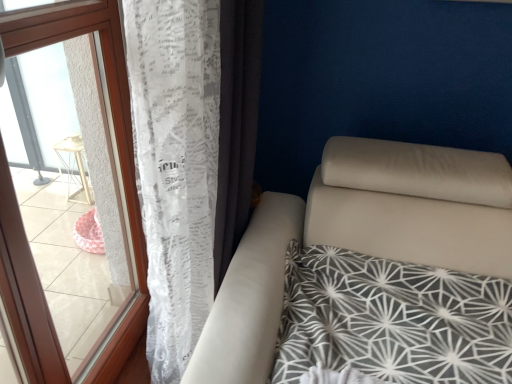
Question: Can you confirm if white lace curtain at left, which ranks as the second curtain in right-to-left order, is positioned to the left of transparent plastic window at left?

Choices:
 (A) no
 (B) yes

Answer: (A)

Question: Considering the relative sizes of white lace curtain at left, positioned as the first curtain in left-to-right order, and transparent plastic window at left in the image provided, is white lace curtain at left, positioned as the first curtain in left-to-right order, wider than transparent plastic window at left?

Choices:
 (A) yes
 (B) no

Answer: (A)

Question: Is white lace curtain at left, which ranks as the second curtain in right-to-left order, oriented away from transparent plastic window at left?

Choices:
 (A) no
 (B) yes

Answer: (B)

Question: Is white lace curtain at left, positioned as the first curtain in left-to-right order, closer to the viewer compared to transparent plastic window at left?

Choices:
 (A) yes
 (B) no

Answer: (B)

Question: Can you confirm if white lace curtain at left, positioned as the first curtain in left-to-right order, is taller than transparent plastic window at left?

Choices:
 (A) yes
 (B) no

Answer: (B)

Question: Is white lace curtain at left, the first curtain positioned from the right, in front of or behind transparent plastic window at left in the image?

Choices:
 (A) front
 (B) behind

Answer: (B)

Question: Is white lace curtain at left, the first curtain positioned from the right, inside or outside of transparent plastic window at left?

Choices:
 (A) outside
 (B) inside

Answer: (A)

Question: Considering the positions of point (256, 16) and point (110, 178), is point (256, 16) closer or farther from the camera than point (110, 178)?

Choices:
 (A) closer
 (B) farther

Answer: (A)

Question: From the image's perspective, is white lace curtain at left, the first curtain positioned from the right, located above or below transparent plastic window at left?

Choices:
 (A) above
 (B) below

Answer: (A)

Question: Is white lace curtain at left, positioned as the first curtain in left-to-right order, taller or shorter than transparent plastic window at left?

Choices:
 (A) tall
 (B) short

Answer: (B)

Question: In terms of size, does white lace curtain at left, which ranks as the second curtain in right-to-left order, appear bigger or smaller than transparent plastic window at left?

Choices:
 (A) big
 (B) small

Answer: (A)

Question: Visually, is white lace curtain at left, positioned as the first curtain in left-to-right order, positioned to the left or to the right of transparent plastic window at left?

Choices:
 (A) left
 (B) right

Answer: (B)

Question: From a real-world perspective, is white lace curtain at left, which ranks as the second curtain in right-to-left order, physically located above or below transparent plastic window at left?

Choices:
 (A) below
 (B) above

Answer: (B)

Question: Does point click(223, 54) appear closer or farther from the camera than point click(181, 364)?

Choices:
 (A) farther
 (B) closer

Answer: (B)

Question: From a real-world perspective, is white lace curtain at left, the first curtain positioned from the right, above or below white lace curtain at left, which ranks as the second curtain in right-to-left order?

Choices:
 (A) above
 (B) below

Answer: (A)